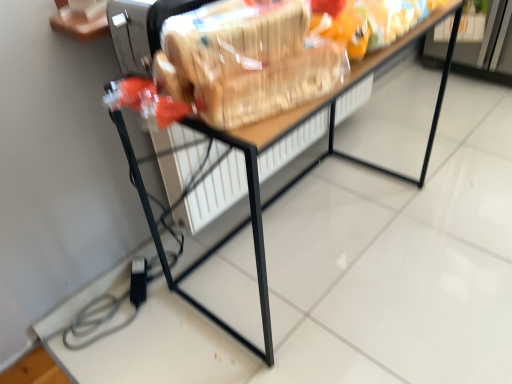
Identify the location of translucent plastic bag at center. (249, 59).

The image size is (512, 384). What do you see at coordinates (249, 59) in the screenshot?
I see `translucent plastic bag at center` at bounding box center [249, 59].

What is the approximate width of translucent plastic bag at center?

11.41 centimeters.

The width and height of the screenshot is (512, 384). I want to click on wooden table at center, so click(296, 176).

Measure the distance between wooden table at center and camera.

wooden table at center is 28.75 inches away from camera.

Image resolution: width=512 pixels, height=384 pixels. What do you see at coordinates (296, 176) in the screenshot?
I see `wooden table at center` at bounding box center [296, 176].

This screenshot has width=512, height=384. Identify the location of translucent plastic bag at center. (249, 59).

Which is more to the left, wooden table at center or translucent plastic bag at center?

Positioned to the left is translucent plastic bag at center.

Which object is more forward, wooden table at center or translucent plastic bag at center?

translucent plastic bag at center is in front.

Which is in front, point (220, 137) or point (308, 65)?

Positioned in front is point (220, 137).

From the image's perspective, is wooden table at center above or below translucent plastic bag at center?

Clearly, from the image's perspective, wooden table at center is below translucent plastic bag at center.

From a real-world perspective, is wooden table at center over translucent plastic bag at center?

No, from a real-world perspective, wooden table at center is not above translucent plastic bag at center.

Can you confirm if wooden table at center is wider than translucent plastic bag at center?

Yes, wooden table at center is wider than translucent plastic bag at center.

Which of these two, wooden table at center or translucent plastic bag at center, stands taller?

wooden table at center.

Considering the relative sizes of wooden table at center and translucent plastic bag at center in the image provided, is wooden table at center bigger than translucent plastic bag at center?

Yes.

Is wooden table at center situated inside translucent plastic bag at center or outside?

The correct answer is: outside.

Is wooden table at center positioned far away from translucent plastic bag at center?

That's not correct — wooden table at center is a little close to translucent plastic bag at center.

Could you tell me if wooden table at center is turned towards translucent plastic bag at center?

No, wooden table at center is not turned towards translucent plastic bag at center.

This screenshot has width=512, height=384. There is a wooden table at center. Identify the location of stuff above it (from a real-world perspective). pyautogui.click(x=249, y=59).

Which is more to the right, translucent plastic bag at center or wooden table at center?

wooden table at center is more to the right.

Is translucent plastic bag at center positioned before wooden table at center?

Yes, translucent plastic bag at center is closer to the viewer.

Which point is more forward, (x=307, y=80) or (x=190, y=299)?

The point (x=307, y=80) is more forward.

From the image's perspective, between translucent plastic bag at center and wooden table at center, who is located below?

wooden table at center, from the image's perspective.

From a real-world perspective, is translucent plastic bag at center located beneath wooden table at center?

No, from a real-world perspective, translucent plastic bag at center is not below wooden table at center.

Considering the sizes of objects translucent plastic bag at center and wooden table at center in the image provided, who is wider, translucent plastic bag at center or wooden table at center?

wooden table at center.

Can you confirm if translucent plastic bag at center is taller than wooden table at center?

No.

Who is smaller, translucent plastic bag at center or wooden table at center?

translucent plastic bag at center.

Is translucent plastic bag at center spatially inside wooden table at center, or outside of it?

translucent plastic bag at center is spatially situated outside wooden table at center.

Is translucent plastic bag at center far away from wooden table at center?

No, translucent plastic bag at center is not far away from wooden table at center.

Does translucent plastic bag at center turn towards wooden table at center?

No, translucent plastic bag at center is not turned towards wooden table at center.

How many degrees apart are the facing directions of translucent plastic bag at center and wooden table at center?

The facing directions of translucent plastic bag at center and wooden table at center are 17.6 degrees apart.

Image resolution: width=512 pixels, height=384 pixels. Find the location of `table lying on the right of translucent plastic bag at center`. table lying on the right of translucent plastic bag at center is located at coordinates (296, 176).

Image resolution: width=512 pixels, height=384 pixels. Identify the location of table that is on the right side of translucent plastic bag at center. (296, 176).

Where is `stuff in front of the wooden table at center`? This screenshot has width=512, height=384. stuff in front of the wooden table at center is located at coordinates (249, 59).